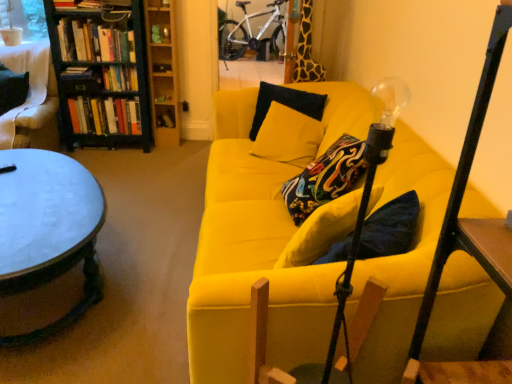
Image resolution: width=512 pixels, height=384 pixels. What are the coordinates of `vacant space that's between wooden bookcase at upper center, which is the first bookcase in right-to-left order, and metallic round table at left` in the screenshot? It's located at (142, 192).